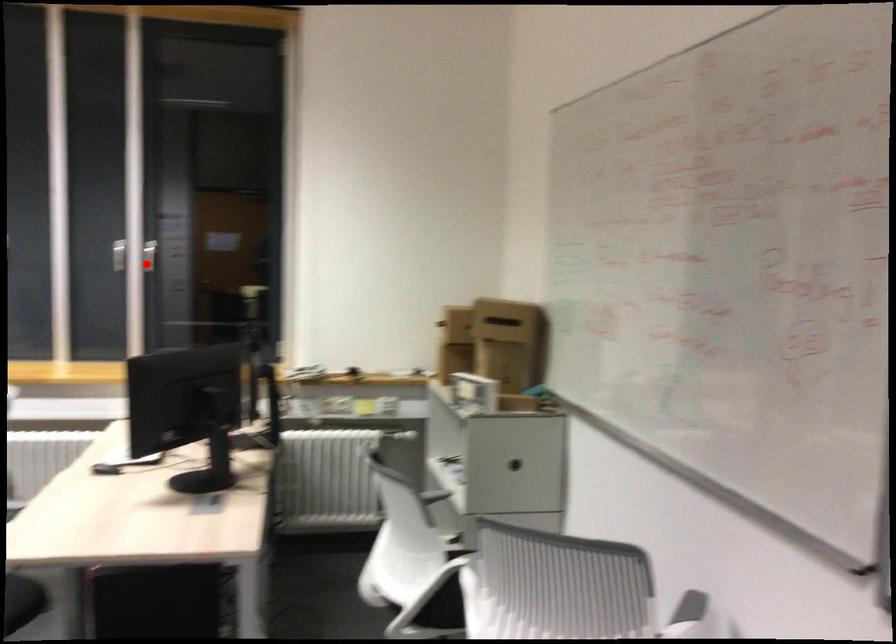
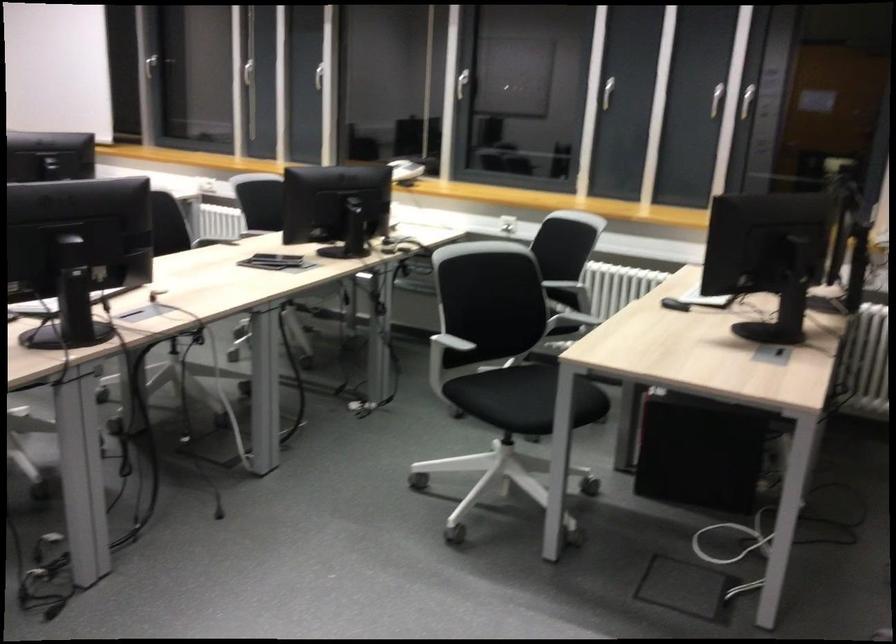
Question: I am providing you with two images of the same scene from different viewpoints. Image1 has a red point marked. In image2, the corresponding 3D location appears at what relative position? Reply with the corresponding letter.

Choices:
 (A) Closer
 (B) Farther

Answer: (A)